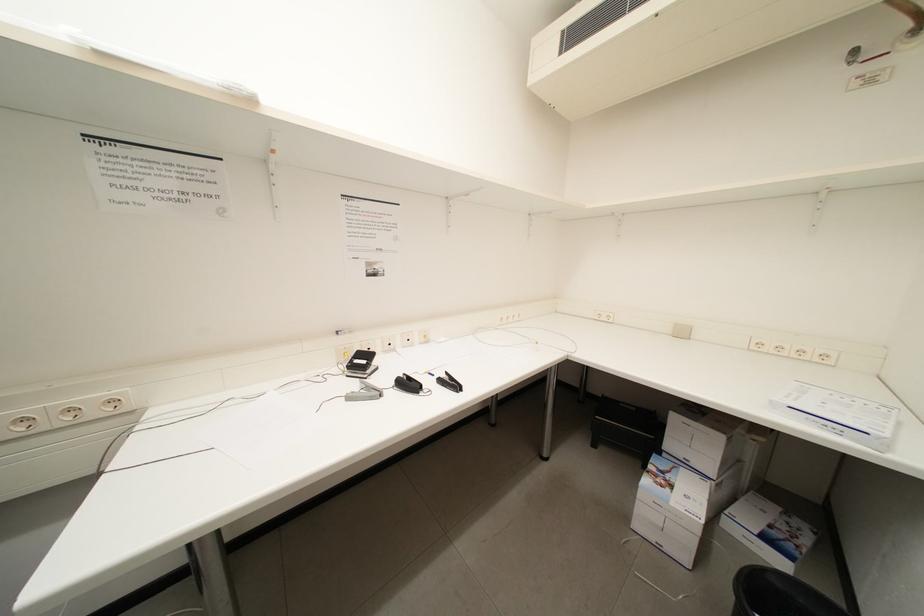
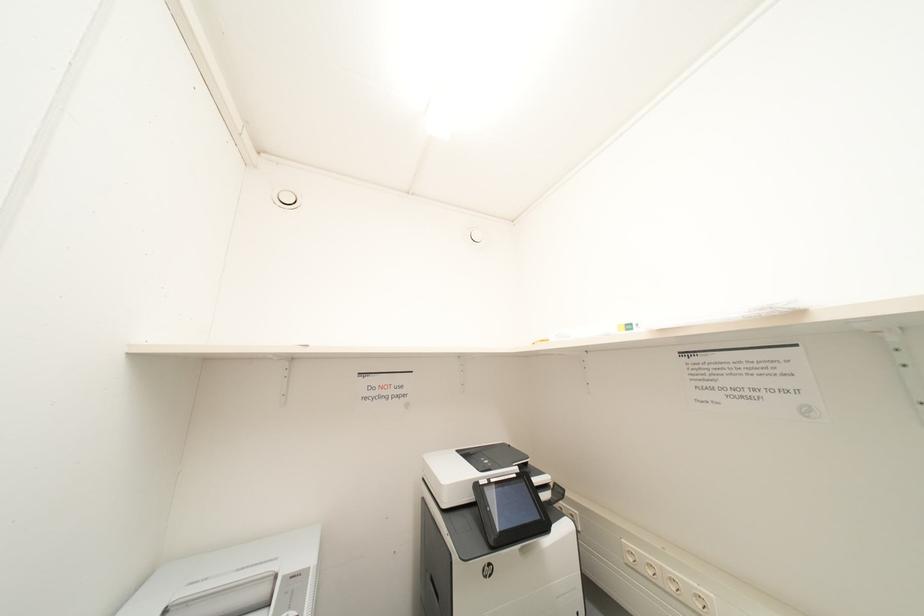
Question: The first image is from the beginning of the video and the second image is from the end. How did the camera likely rotate when shooting the video?

Choices:
 (A) Left
 (B) Right
 (C) Up
 (D) Down

Answer: (A)